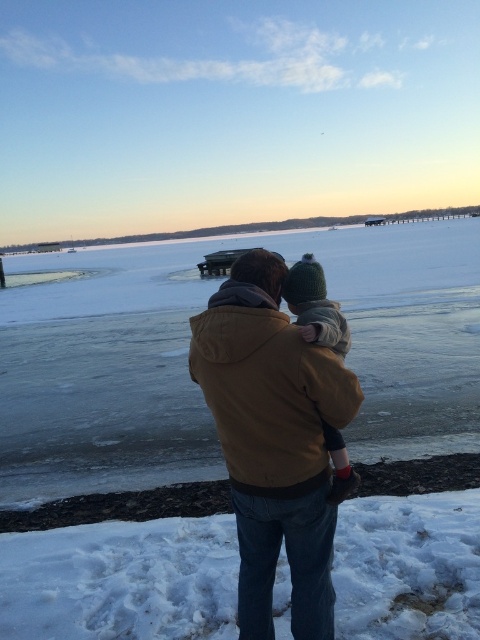
You are a photographer standing in the winter scene. You want to take a photo of the brown cotton jacket at center and the white fluffy snow at lower center. Which object is closer to the camera based on their positions?

The brown cotton jacket at center is closer to the camera than the white fluffy snow at lower center because the brown cotton jacket at center is taller than the white fluffy snow at lower center.

You are standing in the winter scene and want to place a small red sled exactly where the white fluffy snow at lower center is located. According to the coordinates provided, is the sled placed closer to the bottom or the top of the image?

The white fluffy snow at lower center is located at coordinates point (120, 580). Since the y coordinate is 0.252, which is closer to the bottom of the image, the sled would be placed closer to the bottom.